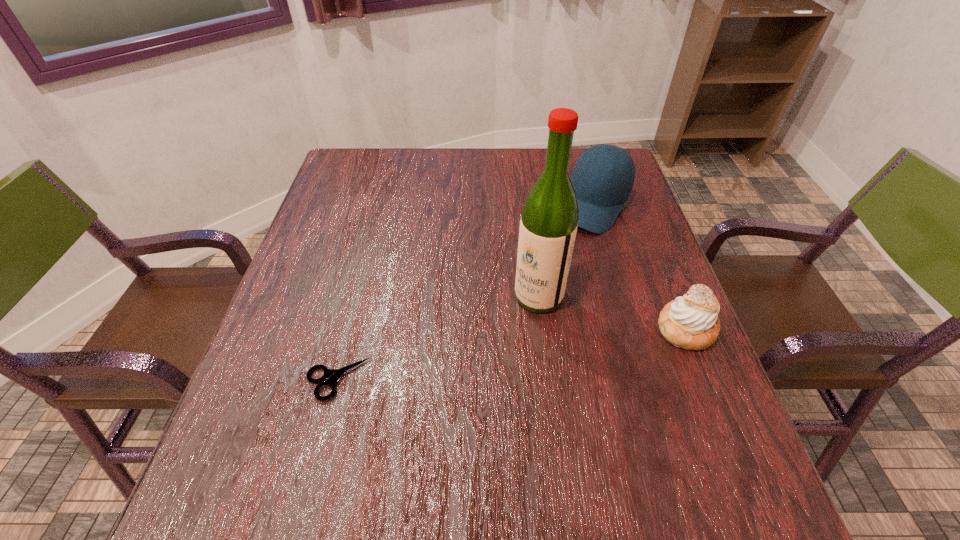
Find the location of a particular element. The height and width of the screenshot is (540, 960). vacant area that lies between the baseball cap and the shears is located at coordinates (466, 293).

Locate an element on the screen. This screenshot has height=540, width=960. free space between the tallest object and the second shortest object is located at coordinates (612, 313).

Find the location of `free spot between the farthest object and the shortest object`. free spot between the farthest object and the shortest object is located at coordinates (466, 293).

What are the coordinates of `object that can be found as the third closest to the pastry` in the screenshot? It's located at (332, 375).

Find the location of `object that can be found as the third closest to the pastry`. object that can be found as the third closest to the pastry is located at coordinates (332, 375).

Identify the location of vacant space that satisfies the following two spatial constraints: 1. on the front side of the third tallest object; 2. on the right side of the baseball cap. The height and width of the screenshot is (540, 960). (630, 328).

Locate an element on the screen. The height and width of the screenshot is (540, 960). vacant area that satisfies the following two spatial constraints: 1. on the back side of the farthest object; 2. on the left side of the shears is located at coordinates (382, 205).